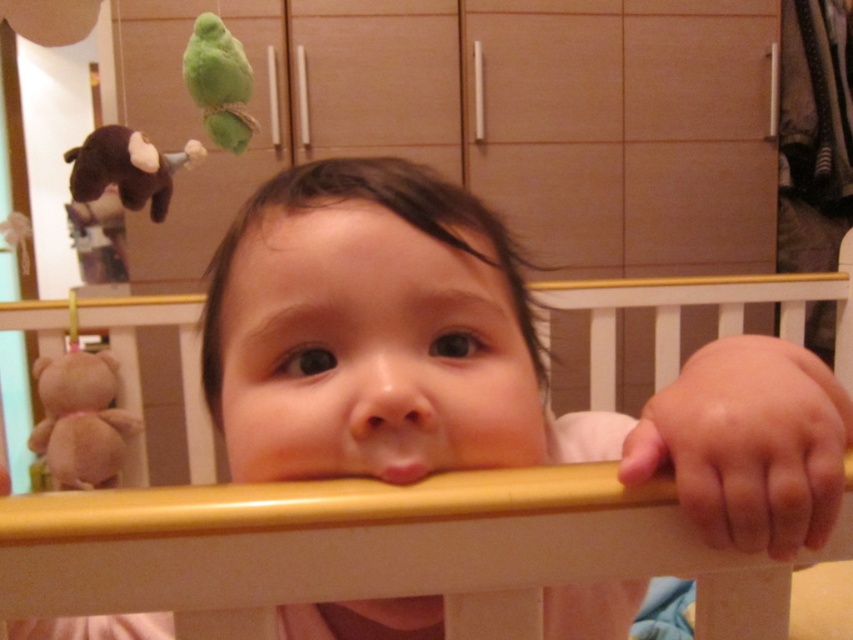
Question: Among these objects, which one is farthest from the camera?

Choices:
 (A) pink matte mouth at center
 (B) brown plush monkey at left

Answer: (B)

Question: Does brown plush bear at left appear over brown plush monkey at left?

Choices:
 (A) yes
 (B) no

Answer: (B)

Question: In this image, where is brown plush bear at left located relative to pink matte mouth at center?

Choices:
 (A) below
 (B) above

Answer: (A)

Question: Which of these objects is positioned closest to the brown plush bear at left?

Choices:
 (A) wooden crib at center
 (B) pink matte mouth at center

Answer: (A)

Question: Is green plush parrot at upper left to the left of pink matte mouth at center from the viewer's perspective?

Choices:
 (A) no
 (B) yes

Answer: (B)

Question: Which of the following is the farthest from the observer?

Choices:
 (A) wooden crib at center
 (B) brown plush monkey at left

Answer: (A)